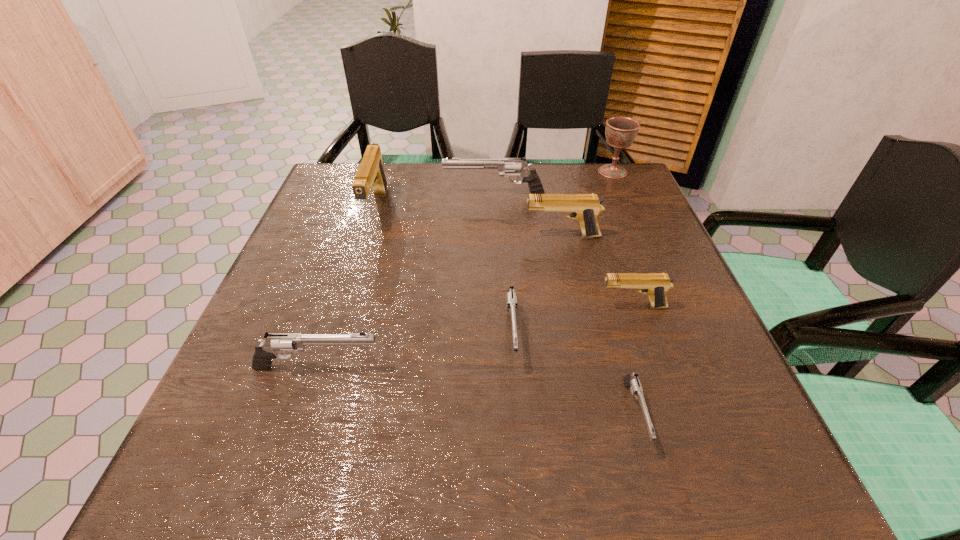
You are a GUI agent. You are given a task and a screenshot of the screen. Output one action in this format:
    pyautogui.click(x=<x>, y=<y>)
    Task: Click on the pistol that stands as the closest to the nearest silver pistol
    The height and width of the screenshot is (540, 960).
    Given the screenshot: What is the action you would take?
    pyautogui.click(x=656, y=285)

Locate an element on the screen. tan pistol that can be found as the third closest to the biggest silver pistol is located at coordinates (656, 285).

Select which tan pistol appears as the third closest to the second smallest silver pistol. Please provide its 2D coordinates. Your answer should be formatted as a tuple, i.e. [(x, y)], where the tuple contains the x and y coordinates of a point satisfying the conditions above.

[(370, 175)]

The width and height of the screenshot is (960, 540). I want to click on silver pistol that is the third closest to the biggest silver pistol, so click(x=631, y=380).

Locate an element on the screen. silver pistol that stands as the third closest to the second shortest pistol is located at coordinates (508, 167).

Locate an element on the screen. free spot that satisfies the following two spatial constraints: 1. at the barrel of the nearest tan pistol; 2. on the front-facing side of the second smallest silver pistol is located at coordinates (641, 333).